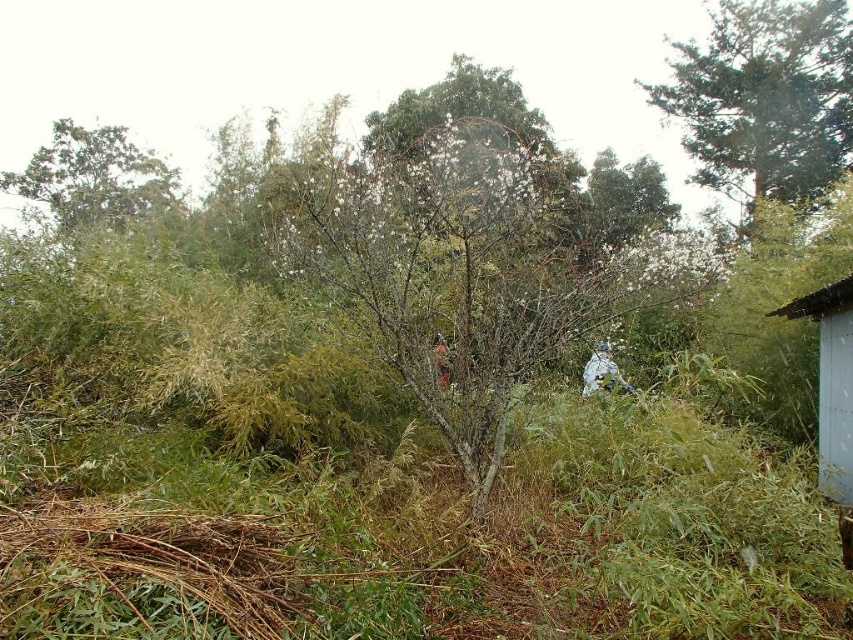
Question: Is green matte tree at center to the right of white wood hut at right from the viewer's perspective?

Choices:
 (A) yes
 (B) no

Answer: (B)

Question: Which object is closer to the camera taking this photo?

Choices:
 (A) green matte tree at center
 (B) green leafy tree at upper left

Answer: (A)

Question: Which point is closer to the camera?

Choices:
 (A) (607, 355)
 (B) (817, 289)

Answer: (B)

Question: Can you confirm if green textured tree at upper right is positioned to the left of white fabric at center?

Choices:
 (A) yes
 (B) no

Answer: (B)

Question: Is green textured tree at upper right smaller than white matte person at center?

Choices:
 (A) no
 (B) yes

Answer: (A)

Question: Estimate the real-world distances between objects in this image. Which object is farther from the green matte tree at center?

Choices:
 (A) green leafy tree at upper left
 (B) white wood hut at right
 (C) white matte person at center
 (D) white fabric at center

Answer: (A)